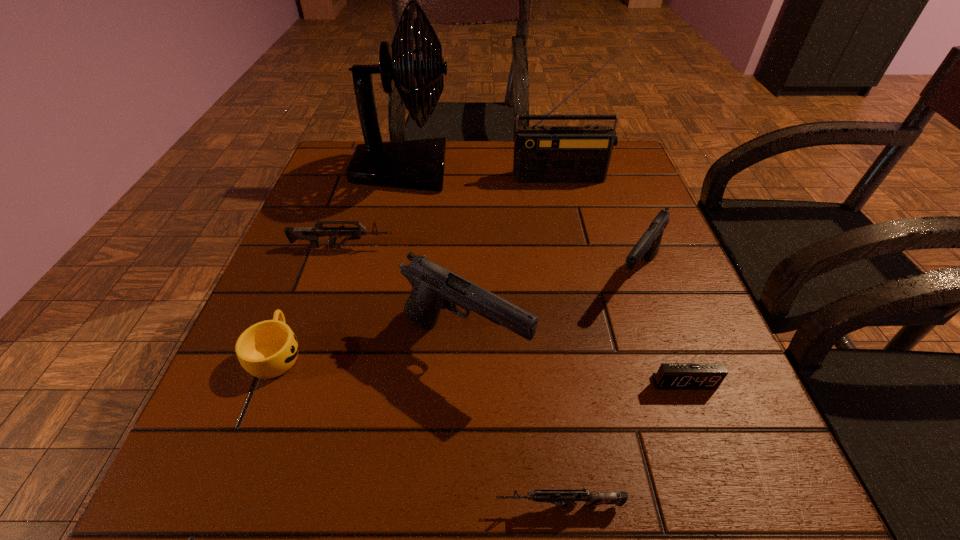
I want to click on vacant area situated 0.270m aimed along the barrel of the smaller grey gun, so click(286, 505).

Where is `free space located aimed along the barrel of the smaller grey gun`? free space located aimed along the barrel of the smaller grey gun is located at coordinates (449, 505).

In order to click on fan that is at the far edge in this screenshot , I will do `click(416, 164)`.

Locate an element on the screen. The image size is (960, 540). radio receiver situated at the far edge is located at coordinates (542, 154).

The image size is (960, 540). Find the location of `object that is positioned at the near edge`. object that is positioned at the near edge is located at coordinates (567, 498).

What are the coordinates of `fan present at the left edge` in the screenshot? It's located at (416, 164).

Where is `gun that is positioned at the left edge`? The width and height of the screenshot is (960, 540). gun that is positioned at the left edge is located at coordinates (312, 234).

At what (x,y) coordinates should I click in order to perform the action: click on cup that is at the left edge. Please return your answer as a coordinate pair (x, y). This screenshot has width=960, height=540. Looking at the image, I should click on (267, 349).

Locate an element on the screen. radio receiver that is at the right edge is located at coordinates (542, 154).

Locate an element on the screen. gun situated at the right edge is located at coordinates (648, 245).